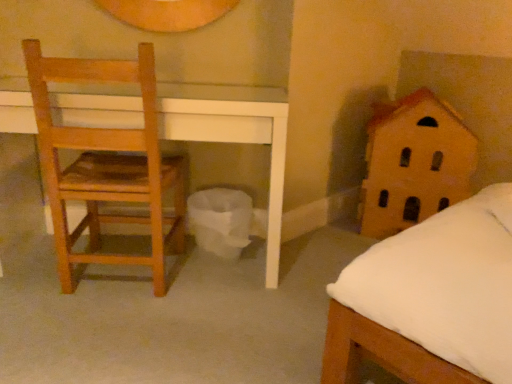
In order to click on unoccupied area in front of wooden chair at left in this screenshot , I will do `click(99, 334)`.